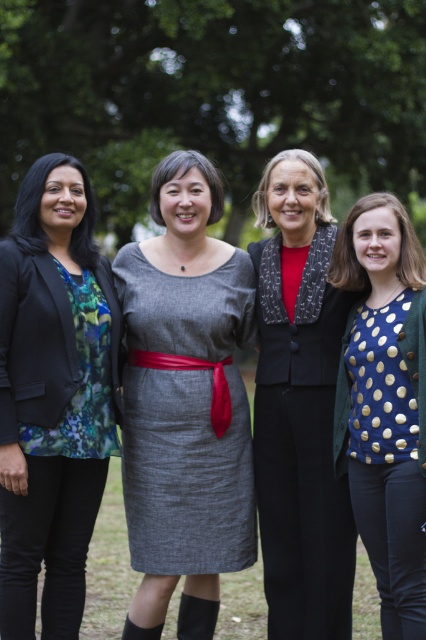
Question: Among these points, which one is farthest from the camera?

Choices:
 (A) (63, 420)
 (B) (241, 531)
 (C) (319, 614)

Answer: (B)

Question: Is matte black blazer at left wider than gray woolen dress at center?

Choices:
 (A) yes
 (B) no

Answer: (B)

Question: Which of the following is the closest to the observer?

Choices:
 (A) (351, 456)
 (B) (154, 552)
 (C) (270, 435)
 (D) (52, 456)

Answer: (D)

Question: Does matte black blazer at center lie in front of gray woolen dress at center?

Choices:
 (A) no
 (B) yes

Answer: (B)

Question: Is matte black blazer at left behind matte black blazer at center?

Choices:
 (A) yes
 (B) no

Answer: (B)

Question: Which point is farther to the camera?

Choices:
 (A) (382, 387)
 (B) (141, 266)
 (C) (342, 582)

Answer: (B)